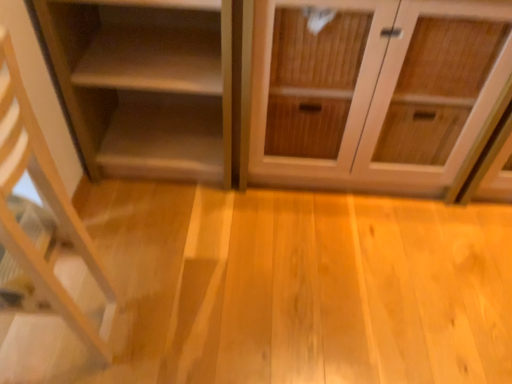
What do you see at coordinates (374, 92) in the screenshot? This screenshot has width=512, height=384. I see `wooden cabinet at center` at bounding box center [374, 92].

This screenshot has width=512, height=384. What do you see at coordinates (48, 213) in the screenshot?
I see `light wood shelf at left, the 2th shelf positioned from the back` at bounding box center [48, 213].

Where is `wooden cabinet at center`? The height and width of the screenshot is (384, 512). wooden cabinet at center is located at coordinates (374, 92).

Between wooden cabinet at center and light wood shelf at left, which appears as the 1th shelf when viewed from the front, which one has less height?

Standing shorter between the two is wooden cabinet at center.

From the image's perspective, which is below, wooden cabinet at center or light wood shelf at left, which appears as the 1th shelf when viewed from the front?

light wood shelf at left, which appears as the 1th shelf when viewed from the front, from the image's perspective.

What's the angular difference between wooden cabinet at center and light wood shelf at left, which appears as the 1th shelf when viewed from the front,'s facing directions?

86.5 degrees.

Considering the positions of objects wooden cabinet at center and light wood shelf at left, the 2th shelf positioned from the back, in the image provided, who is more to the left, wooden cabinet at center or light wood shelf at left, the 2th shelf positioned from the back,?

light wood shelf at left, the 2th shelf positioned from the back, is more to the left.

Is wooden cabinet at center at the right side of matte wood shelf at left, positioned as the first shelf in back-to-front order?

Indeed, wooden cabinet at center is positioned on the right side of matte wood shelf at left, positioned as the first shelf in back-to-front order.

Find the location of `shelf below the wooden cabinet at center (from a real-world perspective)`. shelf below the wooden cabinet at center (from a real-world perspective) is located at coordinates (146, 84).

Is wooden cabinet at center further to camera compared to matte wood shelf at left, positioned as the first shelf in back-to-front order?

No, it is not.

Based on the photo, is matte wood shelf at left, positioned as the first shelf in back-to-front order, a part of wooden cabinet at center?

No, matte wood shelf at left, positioned as the first shelf in back-to-front order, is not surrounded by wooden cabinet at center.

The width and height of the screenshot is (512, 384). In the image, there is a light wood shelf at left, the 2th shelf positioned from the back. In order to click on cabinetry below it (from a real-world perspective) in this screenshot , I will do pos(374,92).

How many degrees apart are the facing directions of light wood shelf at left, the 2th shelf positioned from the back, and wooden cabinet at center?

The angular difference between light wood shelf at left, the 2th shelf positioned from the back, and wooden cabinet at center is 86.5 degrees.

Does light wood shelf at left, which appears as the 1th shelf when viewed from the front, touch wooden cabinet at center?

No, light wood shelf at left, which appears as the 1th shelf when viewed from the front, is not next to wooden cabinet at center.

From the picture: Is light wood shelf at left, which appears as the 1th shelf when viewed from the front, at the left side of wooden cabinet at center?

Yes.

Are light wood shelf at left, which appears as the 1th shelf when viewed from the front, and matte wood shelf at left, the second shelf from the front, located far from each other?

That's not correct — light wood shelf at left, which appears as the 1th shelf when viewed from the front, is a little close to matte wood shelf at left, the second shelf from the front.

Which is more to the right, light wood shelf at left, which appears as the 1th shelf when viewed from the front, or matte wood shelf at left, positioned as the first shelf in back-to-front order?

From the viewer's perspective, matte wood shelf at left, positioned as the first shelf in back-to-front order, appears more on the right side.

Is light wood shelf at left, the 2th shelf positioned from the back, facing towards matte wood shelf at left, positioned as the first shelf in back-to-front order?

No, light wood shelf at left, the 2th shelf positioned from the back, is not oriented towards matte wood shelf at left, positioned as the first shelf in back-to-front order.

Is point (18, 68) positioned before point (110, 104)?

Yes, point (18, 68) is in front of point (110, 104).

Is matte wood shelf at left, positioned as the first shelf in back-to-front order, next to wooden cabinet at center and touching it?

No, matte wood shelf at left, positioned as the first shelf in back-to-front order, is not next to wooden cabinet at center.

Considering the positions of objects matte wood shelf at left, the second shelf from the front, and wooden cabinet at center in the image provided, who is more to the left, matte wood shelf at left, the second shelf from the front, or wooden cabinet at center?

matte wood shelf at left, the second shelf from the front, is more to the left.

Does matte wood shelf at left, positioned as the first shelf in back-to-front order, come in front of wooden cabinet at center?

No, matte wood shelf at left, positioned as the first shelf in back-to-front order, is further to the viewer.

From the image's perspective, is matte wood shelf at left, the second shelf from the front, located above or below wooden cabinet at center?

From the image's perspective, matte wood shelf at left, the second shelf from the front, appears above wooden cabinet at center.

From the image's perspective, between matte wood shelf at left, the second shelf from the front, and light wood shelf at left, the 2th shelf positioned from the back, who is located below?

light wood shelf at left, the 2th shelf positioned from the back, is shown below in the image.

I want to click on shelf in front of the matte wood shelf at left, the second shelf from the front, so click(48, 213).

Which of these two, matte wood shelf at left, positioned as the first shelf in back-to-front order, or light wood shelf at left, the 2th shelf positioned from the back, is wider?

Wider between the two is light wood shelf at left, the 2th shelf positioned from the back.

How many degrees apart are the facing directions of matte wood shelf at left, the second shelf from the front, and light wood shelf at left, the 2th shelf positioned from the back?

86.5 degrees separate the facing orientations of matte wood shelf at left, the second shelf from the front, and light wood shelf at left, the 2th shelf positioned from the back.

I want to click on cabinetry below the light wood shelf at left, which appears as the 1th shelf when viewed from the front (from a real-world perspective), so click(x=374, y=92).

Identify the location of cabinetry located on the right of matte wood shelf at left, the second shelf from the front. (374, 92).

Looking at the image, which one is located further to light wood shelf at left, the 2th shelf positioned from the back, wooden cabinet at center or matte wood shelf at left, positioned as the first shelf in back-to-front order?

wooden cabinet at center is positioned further to the anchor light wood shelf at left, the 2th shelf positioned from the back.

In the scene shown: Which object lies nearer to the anchor point matte wood shelf at left, the second shelf from the front, light wood shelf at left, which appears as the 1th shelf when viewed from the front, or wooden cabinet at center?

Based on the image, wooden cabinet at center appears to be nearer to matte wood shelf at left, the second shelf from the front.

Estimate the real-world distances between objects in this image. Which object is further from wooden cabinet at center, matte wood shelf at left, the second shelf from the front, or light wood shelf at left, which appears as the 1th shelf when viewed from the front?

light wood shelf at left, which appears as the 1th shelf when viewed from the front, lies further to wooden cabinet at center than the other object.

Estimate the real-world distances between objects in this image. Which object is further from matte wood shelf at left, positioned as the first shelf in back-to-front order, wooden cabinet at center or light wood shelf at left, the 2th shelf positioned from the back?

light wood shelf at left, the 2th shelf positioned from the back, lies further to matte wood shelf at left, positioned as the first shelf in back-to-front order, than the other object.

Estimate the real-world distances between objects in this image. Which object is further from light wood shelf at left, the 2th shelf positioned from the back, matte wood shelf at left, positioned as the first shelf in back-to-front order, or wooden cabinet at center?

Based on the image, wooden cabinet at center appears to be further to light wood shelf at left, the 2th shelf positioned from the back.

From the image, which object appears to be farther from wooden cabinet at center, light wood shelf at left, the 2th shelf positioned from the back, or matte wood shelf at left, the second shelf from the front?

The object further to wooden cabinet at center is light wood shelf at left, the 2th shelf positioned from the back.

Identify the location of shelf between light wood shelf at left, which appears as the 1th shelf when viewed from the front, and wooden cabinet at center, in the horizontal direction. This screenshot has width=512, height=384. (146, 84).